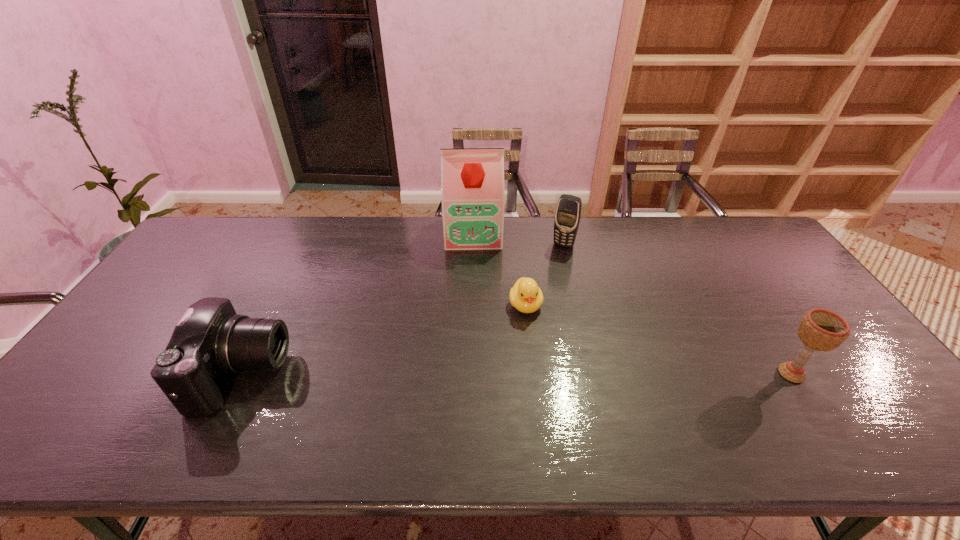
Where is `vacant space that satisfies the following two spatial constraints: 1. on the front side of the soya milk; 2. on the right side of the rightmost object`? This screenshot has width=960, height=540. vacant space that satisfies the following two spatial constraints: 1. on the front side of the soya milk; 2. on the right side of the rightmost object is located at coordinates (470, 374).

I want to click on vacant space that satisfies the following two spatial constraints: 1. on the front side of the cellular telephone; 2. on the right side of the second object from left to right, so pyautogui.click(x=473, y=245).